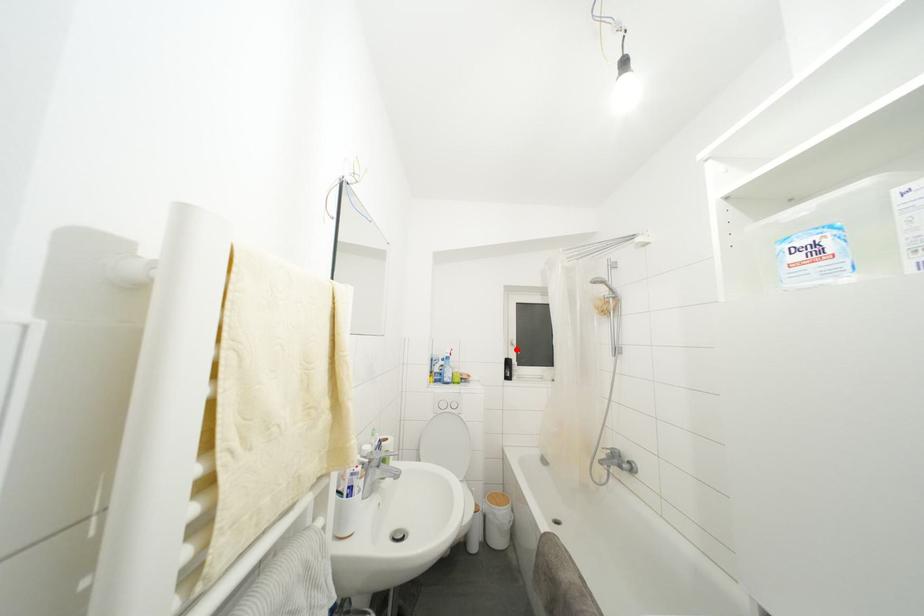
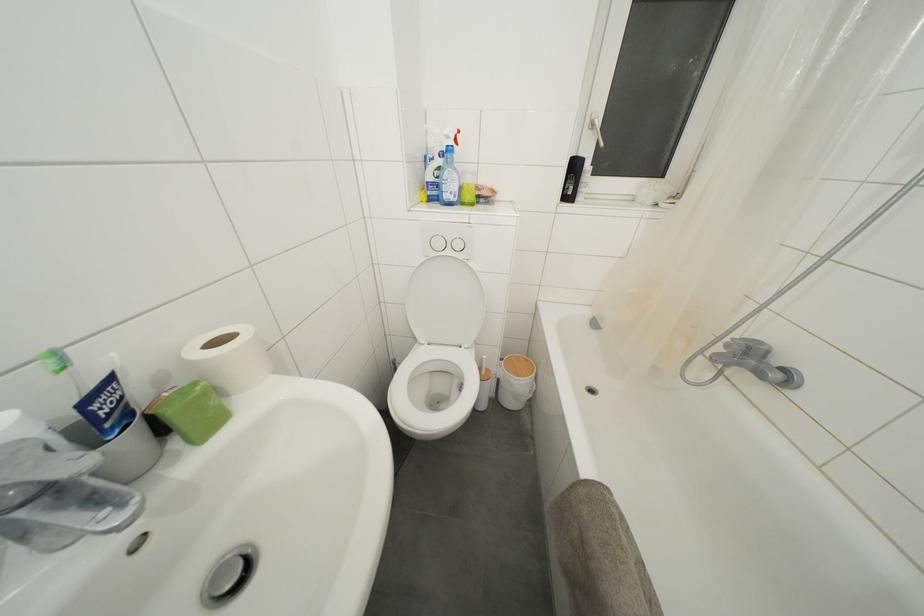
Question: I am providing you with two images of the same scene from different viewpoints. Given a red point in image1, look at the same physical point in image2. Is it:

Choices:
 (A) Closer to the viewpoint
 (B) Farther from the viewpoint

Answer: (A)